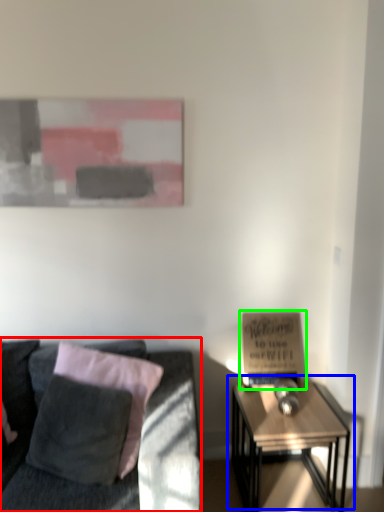
Question: Which object is the farthest from studio couch (highlighted by a red box)? Choose among these: table (highlighted by a blue box) or bulletin board (highlighted by a green box).

Choices:
 (A) table
 (B) bulletin board

Answer: (A)